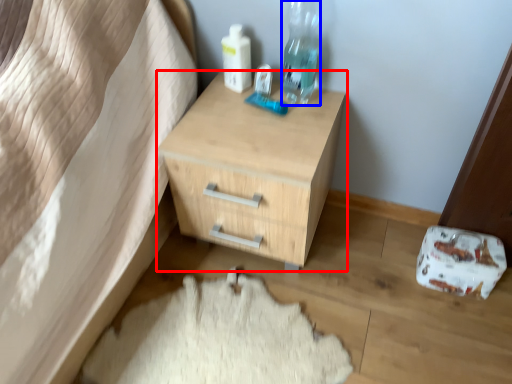
Question: Among these objects, which one is farthest to the camera, chest of drawers (highlighted by a red box) or bottle (highlighted by a blue box)?

Choices:
 (A) chest of drawers
 (B) bottle

Answer: (B)